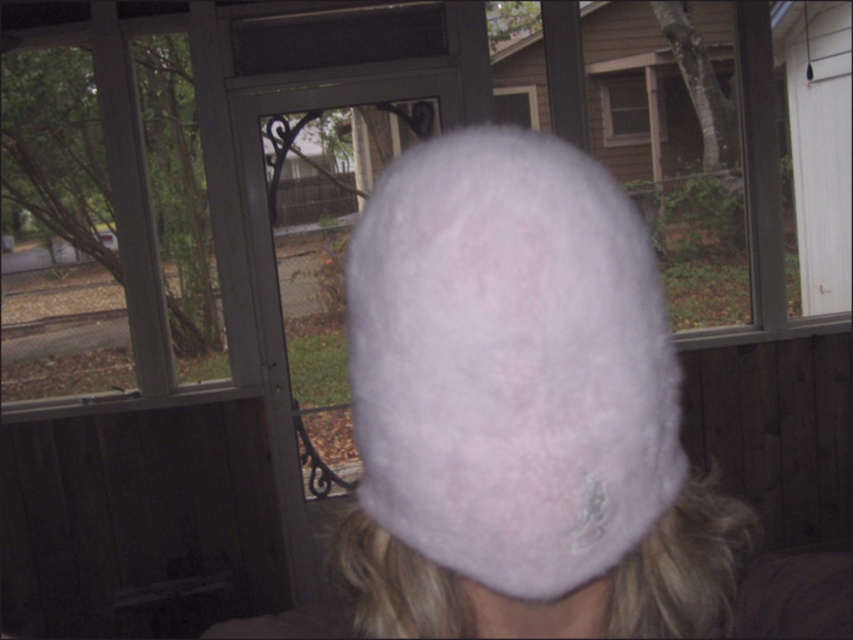
Question: Is fuzzy pink hat at center to the left of clear glass screen door at center from the viewer's perspective?

Choices:
 (A) yes
 (B) no

Answer: (B)

Question: Can you confirm if fuzzy pink hat at center is positioned to the right of clear glass screen door at center?

Choices:
 (A) no
 (B) yes

Answer: (B)

Question: Does fuzzy pink hat at center have a larger size compared to clear glass screen door at center?

Choices:
 (A) no
 (B) yes

Answer: (A)

Question: Which point appears farthest from the camera in this image?

Choices:
 (A) (496, 337)
 (B) (276, 284)

Answer: (B)

Question: Which point is closer to the camera taking this photo?

Choices:
 (A) (357, 429)
 (B) (338, 280)

Answer: (A)

Question: Which point is farther to the camera?

Choices:
 (A) fuzzy pink hat at center
 (B) clear glass screen door at center

Answer: (B)